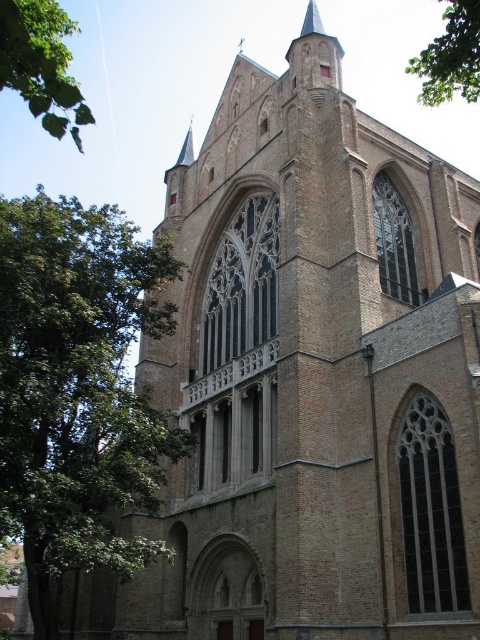
In the scene shown: You are an architect analyzing the symmetry of the church. You observe the green leafy branch at upper left and the green leafy tree at upper right in the image. Which of these two elements has a narrower width?

The green leafy branch at upper left has a lesser width compared to the green leafy tree at upper right, so the green leafy branch at upper left is narrower in width.